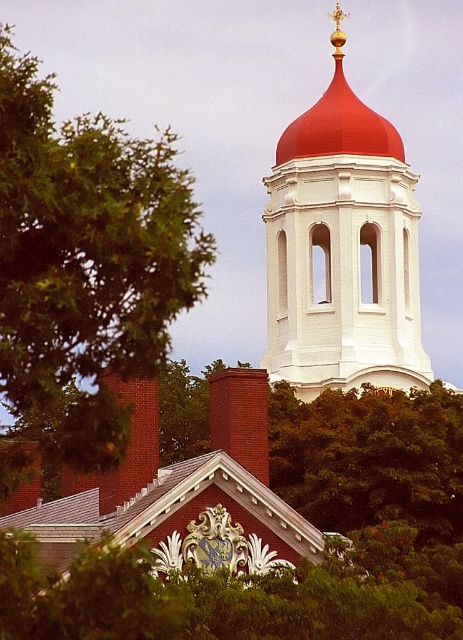
Between white smooth tower at upper center and green leafy tree at center, which one is positioned higher?

Positioned higher is white smooth tower at upper center.

From the picture: Does white smooth tower at upper center appear on the left side of green leafy tree at center?

No, white smooth tower at upper center is not to the left of green leafy tree at center.

Locate an element on the screen. white smooth tower at upper center is located at coordinates (343, 248).

This screenshot has height=640, width=463. In order to click on white smooth tower at upper center in this screenshot , I will do `click(343, 248)`.

Is point (52, 330) positioned in front of point (351, 305)?

Yes, it is.

Does green leafy tree at left appear on the left side of white smooth tower at upper center?

Correct, you'll find green leafy tree at left to the left of white smooth tower at upper center.

Which is in front, point (12, 92) or point (299, 262)?

Point (12, 92) is more forward.

I want to click on green leafy tree at left, so pyautogui.click(x=83, y=269).

Can you confirm if green leafy tree at center is positioned above matte brick church at center?

No.

Is green leafy tree at center positioned before matte brick church at center?

Yes, it is in front of matte brick church at center.

This screenshot has height=640, width=463. Identify the location of green leafy tree at center. (238, 595).